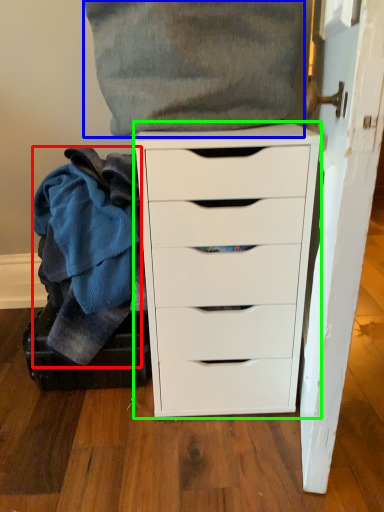
Question: Estimate the real-world distances between objects in this image. Which object is closer to clothing (highlighted by a red box), clothing (highlighted by a blue box) or chest of drawers (highlighted by a green box)?

Choices:
 (A) clothing
 (B) chest of drawers

Answer: (B)